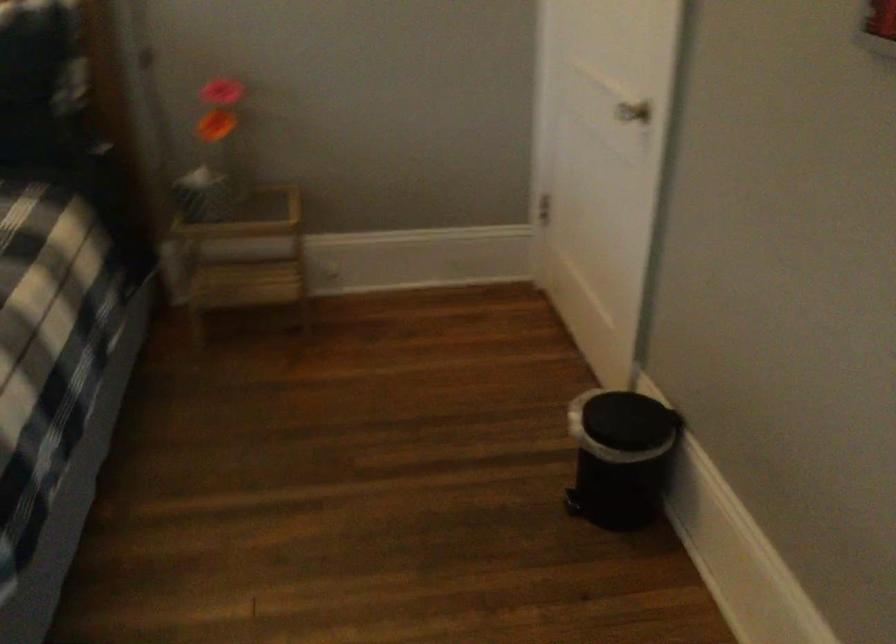
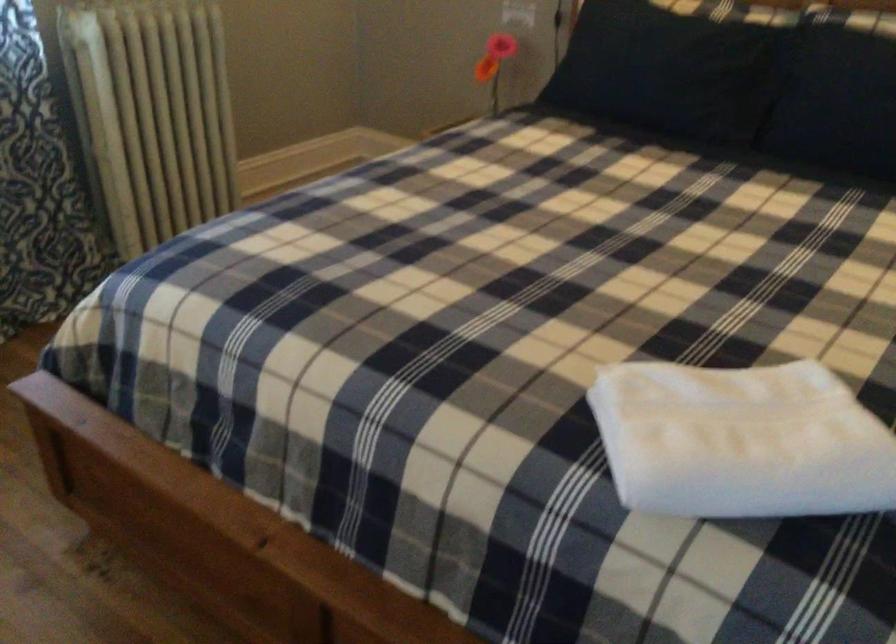
Question: The first image is from the beginning of the video and the second image is from the end. How did the camera likely rotate when shooting the video?

Choices:
 (A) Left
 (B) Right
 (C) Up
 (D) Down

Answer: (A)